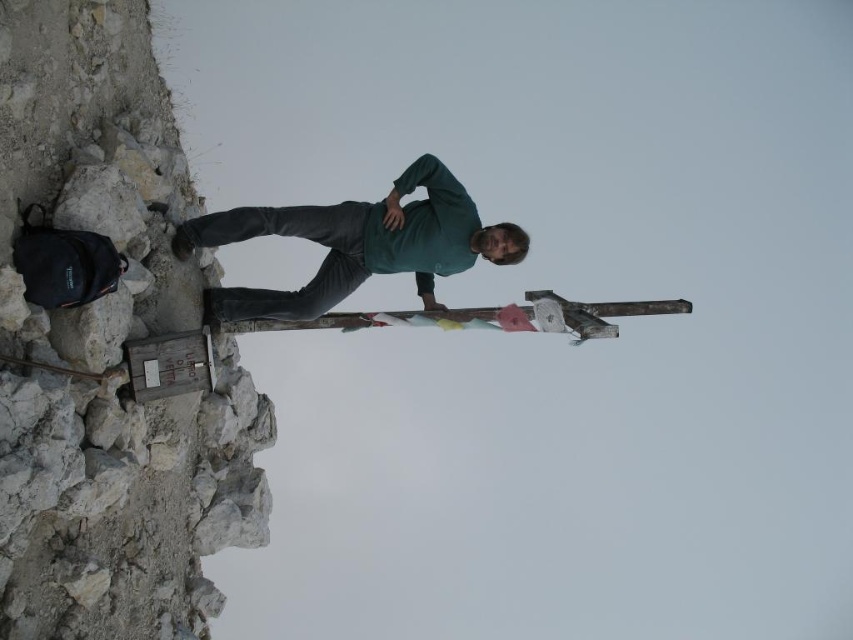
Is point (64, 51) closer to camera compared to point (468, 221)?

Yes, point (64, 51) is in front of point (468, 221).

Does rough stone cliff at left have a lesser width compared to green matte shirt at center?

Yes.

Is point (51, 570) behind point (392, 273)?

No, it is not.

Locate an element on the screen. The height and width of the screenshot is (640, 853). rough stone cliff at left is located at coordinates (125, 502).